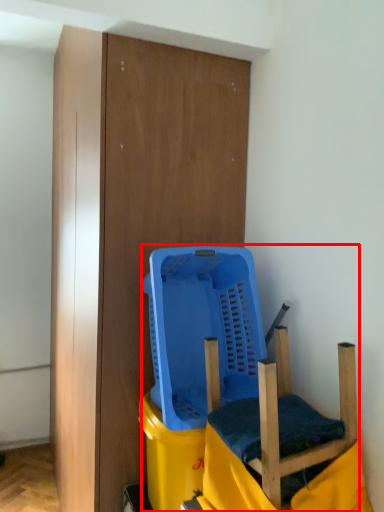
Question: Where is furniture (annotated by the red box) located in relation to swivel chair in the image?

Choices:
 (A) left
 (B) right

Answer: (A)